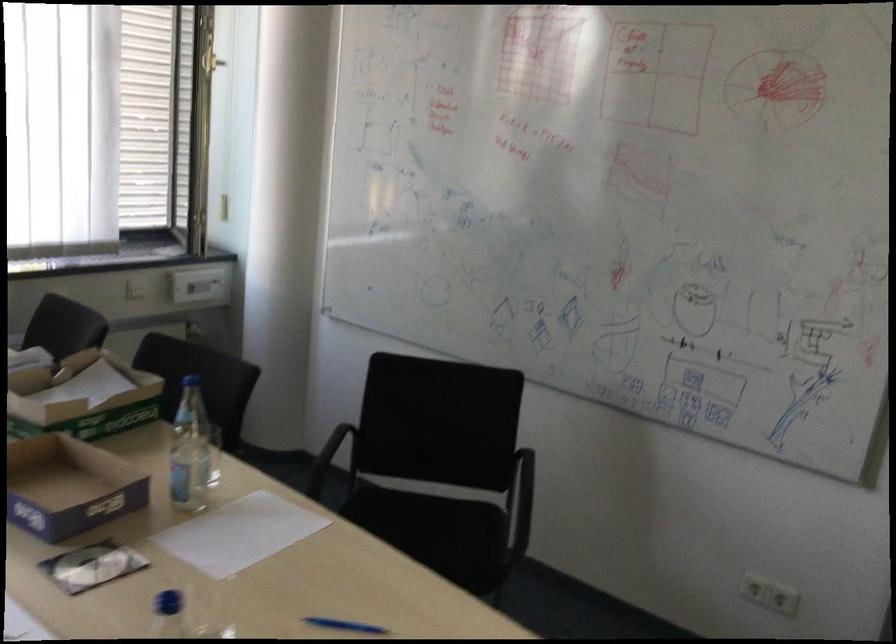
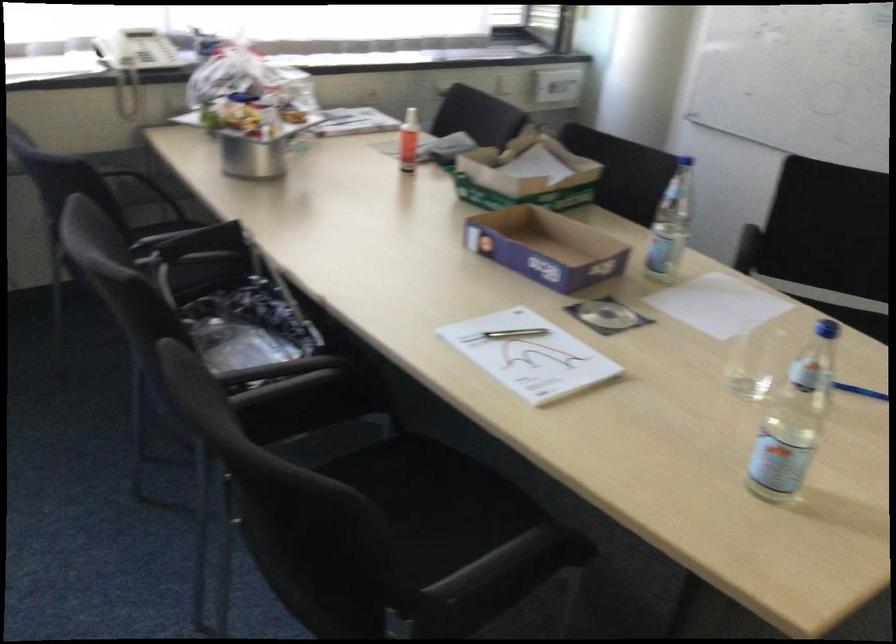
Which direction would the cameraman need to move to produce the second image?

The cameraman moved toward left, backward.